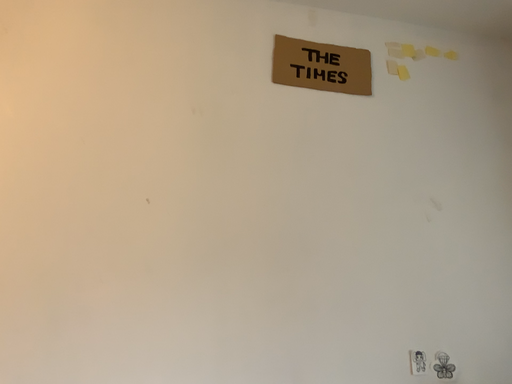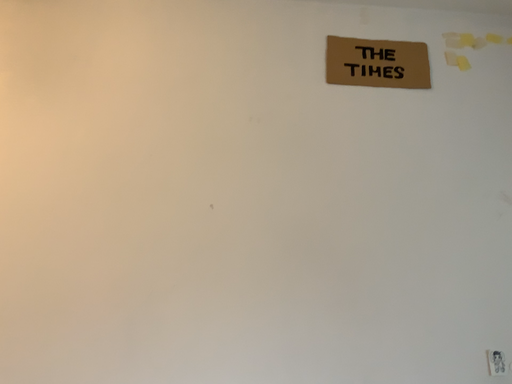
Question: How did the camera likely rotate when shooting the video?

Choices:
 (A) rotated left
 (B) rotated right

Answer: (A)